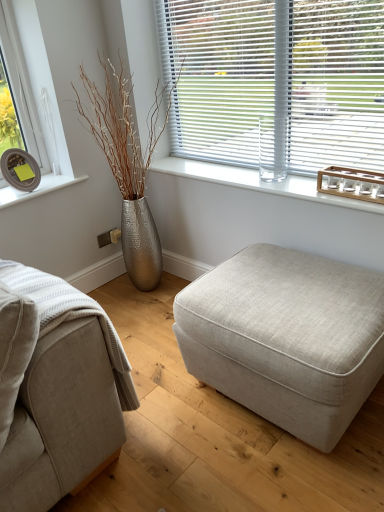
Question: Is beige fabric couch at lower left aimed at beige fabric ottoman at center?

Choices:
 (A) yes
 (B) no

Answer: (B)

Question: From the image's perspective, is beige fabric couch at lower left on beige fabric ottoman at center?

Choices:
 (A) yes
 (B) no

Answer: (A)

Question: Is beige fabric ottoman at center located within beige fabric couch at lower left?

Choices:
 (A) yes
 (B) no

Answer: (B)

Question: Is beige fabric couch at lower left smaller than beige fabric ottoman at center?

Choices:
 (A) yes
 (B) no

Answer: (A)

Question: Can we say beige fabric couch at lower left lies outside beige fabric ottoman at center?

Choices:
 (A) no
 (B) yes

Answer: (B)

Question: In terms of size, does silver textured vase at left appear bigger or smaller than beige fabric ottoman at center?

Choices:
 (A) big
 (B) small

Answer: (A)

Question: Is silver textured vase at left wider or thinner than beige fabric ottoman at center?

Choices:
 (A) thin
 (B) wide

Answer: (A)

Question: From a real-world perspective, relative to beige fabric ottoman at center, is silver textured vase at left vertically above or below?

Choices:
 (A) above
 (B) below

Answer: (A)

Question: From the image's perspective, is silver textured vase at left above or below beige fabric ottoman at center?

Choices:
 (A) above
 (B) below

Answer: (A)

Question: From their relative heights in the image, would you say beige fabric ottoman at center is taller or shorter than white plastic blinds at upper center?

Choices:
 (A) tall
 (B) short

Answer: (B)

Question: From a real-world perspective, relative to white plastic blinds at upper center, is beige fabric ottoman at center vertically above or below?

Choices:
 (A) above
 (B) below

Answer: (B)

Question: From the image's perspective, is beige fabric ottoman at center above or below white plastic blinds at upper center?

Choices:
 (A) above
 (B) below

Answer: (B)

Question: In terms of size, does beige fabric ottoman at center appear bigger or smaller than white plastic blinds at upper center?

Choices:
 (A) small
 (B) big

Answer: (B)

Question: From the image's perspective, relative to white plastic blinds at upper center, is beige fabric couch at lower left above or below?

Choices:
 (A) above
 (B) below

Answer: (B)

Question: Do you think beige fabric couch at lower left is within white plastic blinds at upper center, or outside of it?

Choices:
 (A) outside
 (B) inside

Answer: (A)